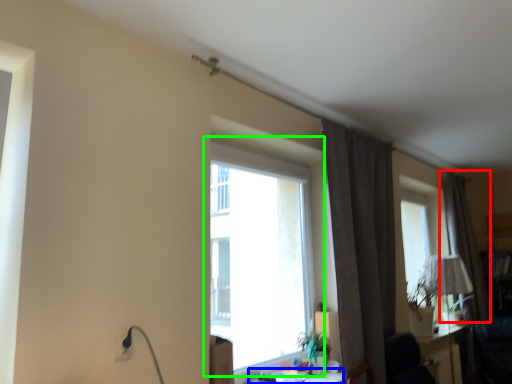
Question: Based on their relative distances, which object is nearer to curtain (highlighted by a red box)? Choose from table (highlighted by a blue box) and window (highlighted by a green box).

Choices:
 (A) table
 (B) window

Answer: (B)